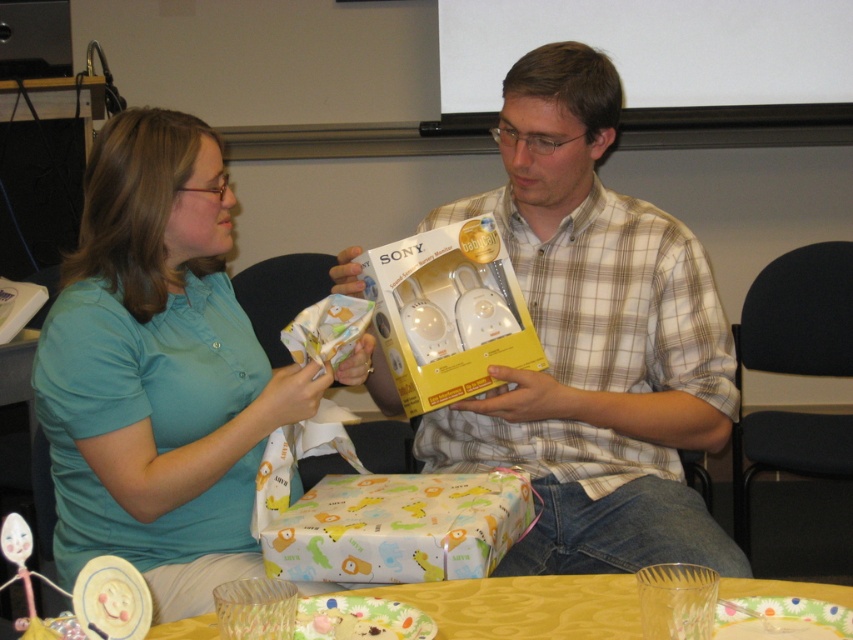
What do you see at coordinates (161, 371) in the screenshot?
I see `teal fabric shirt at center` at bounding box center [161, 371].

Is point (74, 269) positioned in front of point (548, 582)?

No, (74, 269) is behind (548, 582).

This screenshot has width=853, height=640. Identify the location of teal fabric shirt at center. (161, 371).

The width and height of the screenshot is (853, 640). I want to click on teal fabric shirt at center, so click(x=161, y=371).

Does plaid shirt at center have a lesser height compared to teal fabric shirt at center?

No.

Does point (602, 328) come farther from viewer compared to point (148, 278)?

Yes, it is behind point (148, 278).

Locate an element on the screen. plaid shirt at center is located at coordinates (595, 342).

Measure the distance between point (177, 349) and camera.

4.24 feet

Is teal fabric shirt at center wider than printed paper gift at center?

Yes.

Where is `teal fabric shirt at center`? teal fabric shirt at center is located at coordinates (161, 371).

The image size is (853, 640). I want to click on teal fabric shirt at center, so click(161, 371).